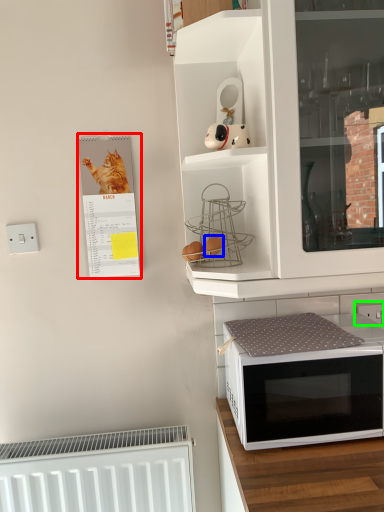
Question: Which object is the closest to the bulletin board (highlighted by a red box)? Choose among these: food (highlighted by a blue box) or electric outlet (highlighted by a green box).

Choices:
 (A) food
 (B) electric outlet

Answer: (A)